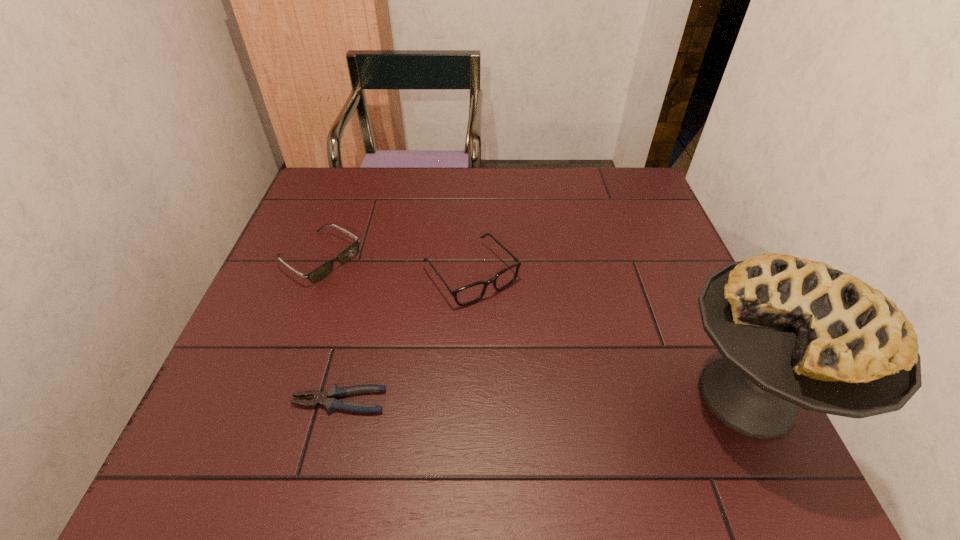
Identify the location of vacant spot on the desktop that is between the pliers and the rightmost object and is positioned on the front-facing side of the sunglasses. The height and width of the screenshot is (540, 960). (538, 399).

In order to click on free space on the desktop that is between the pliers and the rightmost object and is positioned on the front-facing side of the second tallest object in this screenshot , I will do `click(580, 399)`.